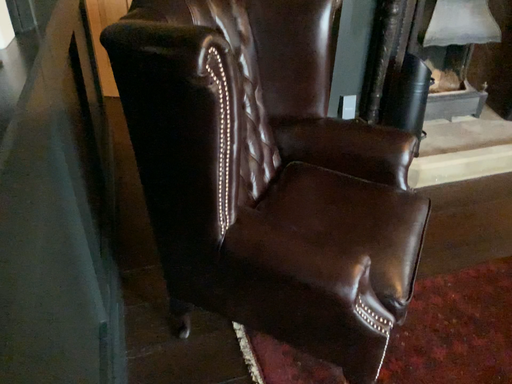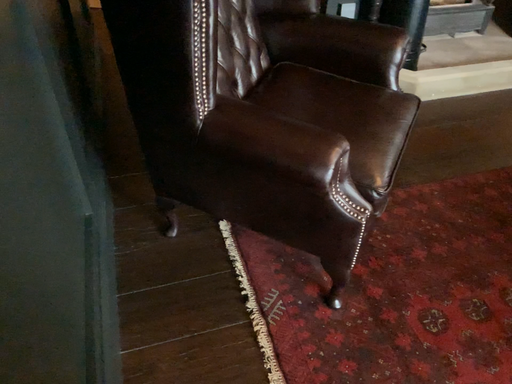
Question: Which way did the camera rotate in the video?

Choices:
 (A) rotated upward
 (B) rotated downward

Answer: (B)